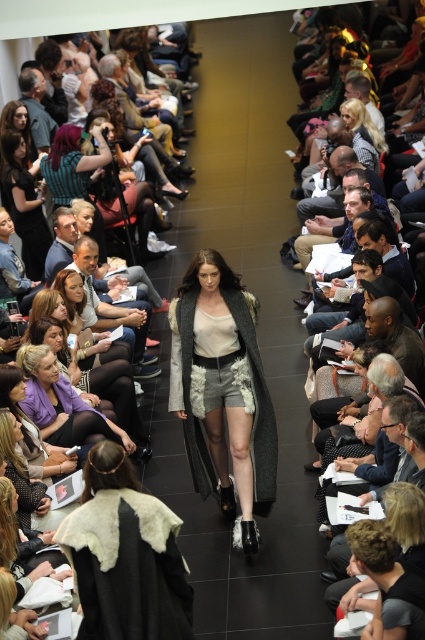
Question: In this image, where is fur-like cape at center located relative to matte purple jacket at lower left?

Choices:
 (A) left
 (B) right

Answer: (B)

Question: Among these objects, which one is farthest from the camera?

Choices:
 (A) matte black hair at upper left
 (B) gray textured coat at center
 (C) purple fabric coat at lower left
 (D) fur-like cape at center

Answer: (A)

Question: Is matte purple jacket at lower left below matte black hair at upper left?

Choices:
 (A) yes
 (B) no

Answer: (A)

Question: Considering the relative positions of purple fabric coat at lower left and matte black hair at upper left in the image provided, where is purple fabric coat at lower left located with respect to matte black hair at upper left?

Choices:
 (A) left
 (B) right

Answer: (B)

Question: Which object is positioned closest to the gray textured coat at center?

Choices:
 (A) matte black hair at upper left
 (B) matte black dress at left

Answer: (B)

Question: Considering the real-world distances, which object is closest to the matte purple jacket at lower left?

Choices:
 (A) gray textured coat at center
 (B) matte black hair at upper left
 (C) purple fabric coat at lower left
 (D) fur-like cape at center

Answer: (C)